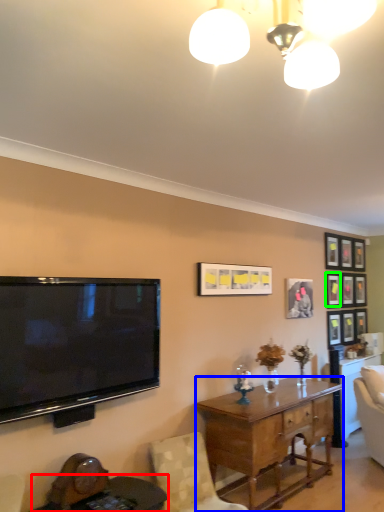
Question: Estimate the real-world distances between objects in this image. Which object is closer to round table (highlighted by a red box), desk (highlighted by a blue box) or picture frame (highlighted by a green box)?

Choices:
 (A) desk
 (B) picture frame

Answer: (A)